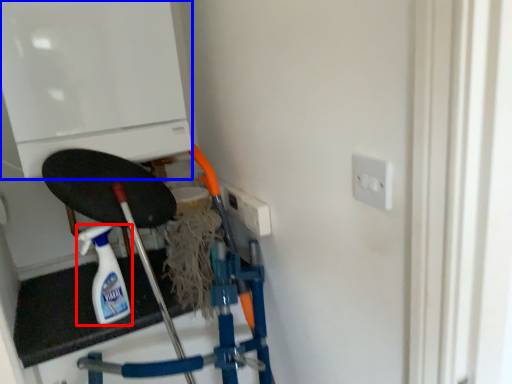
Question: Which point is further to the camera, bottle (highlighted by a red box) or appliance (highlighted by a blue box)?

Choices:
 (A) bottle
 (B) appliance

Answer: (A)